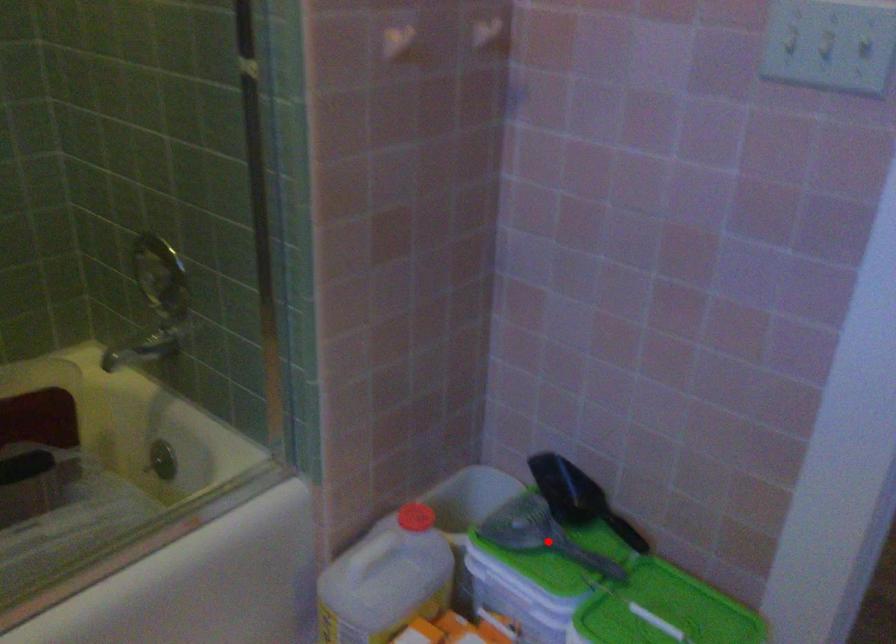
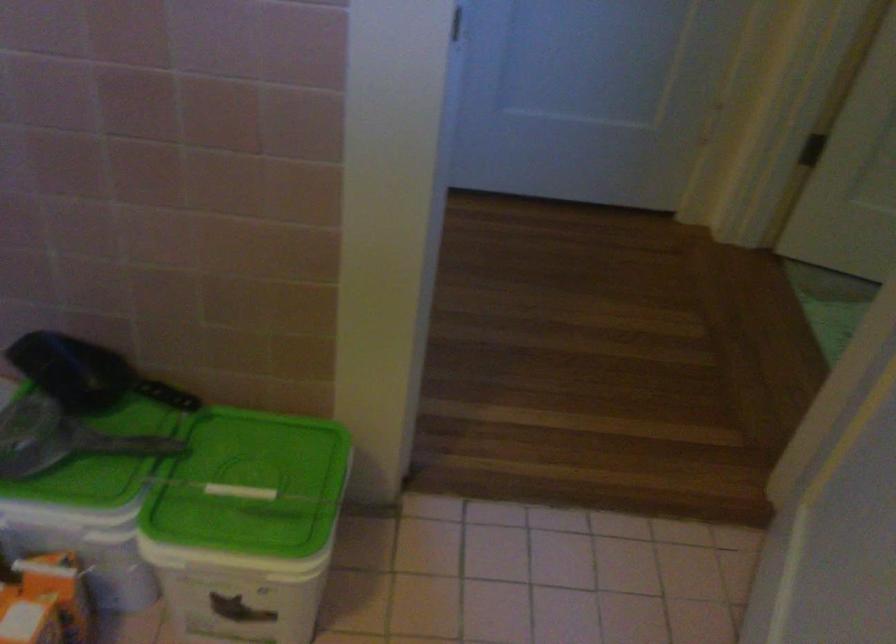
The point at the highlighted location is marked in the first image. Where is the corresponding point in the second image?

(81, 448)